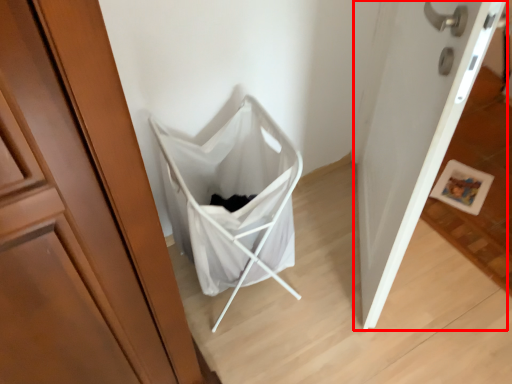
Question: Observing the image, what is the correct spatial positioning of door (annotated by the red box) in reference to baby carriage?

Choices:
 (A) left
 (B) right

Answer: (B)